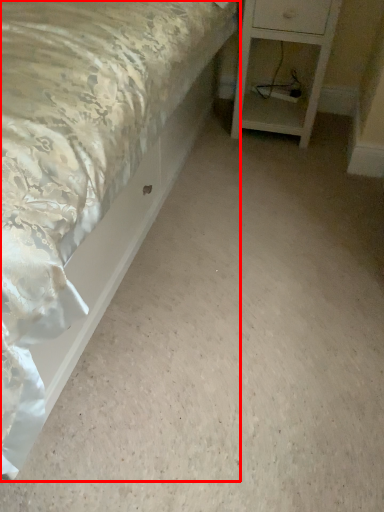
Question: In this image, where is bed (annotated by the red box) located relative to nightstand?

Choices:
 (A) left
 (B) right

Answer: (A)